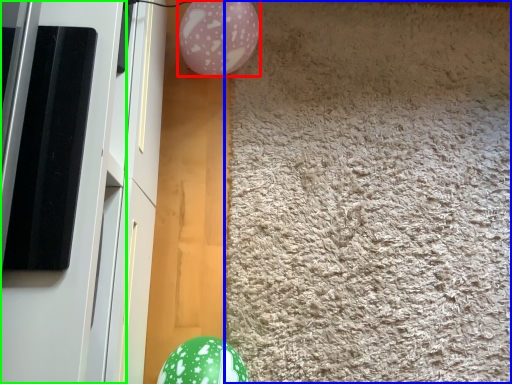
Question: Based on their relative distances, which object is nearer to balloon (highlighted by a red box)? Choose from mat (highlighted by a blue box) and screen door (highlighted by a green box).

Choices:
 (A) mat
 (B) screen door

Answer: (A)